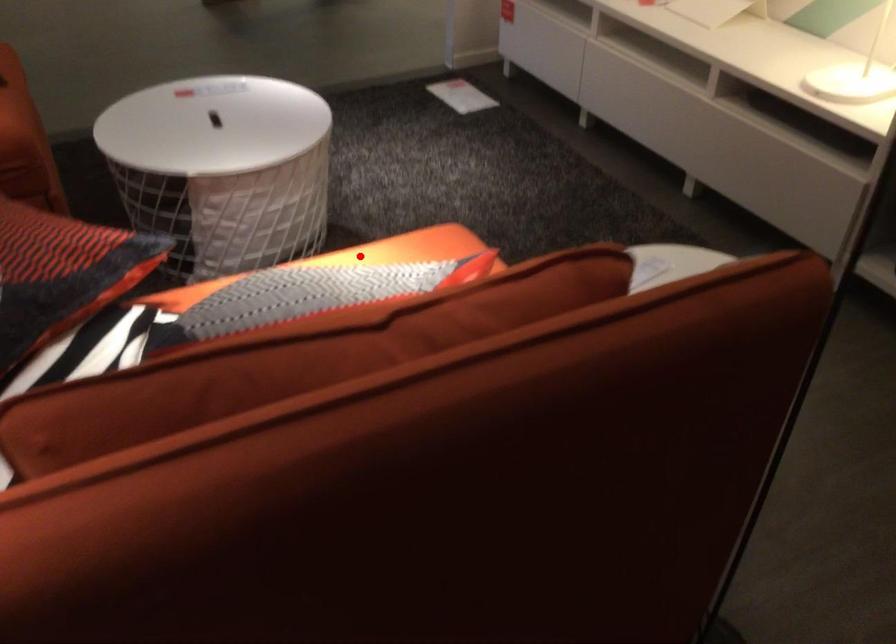
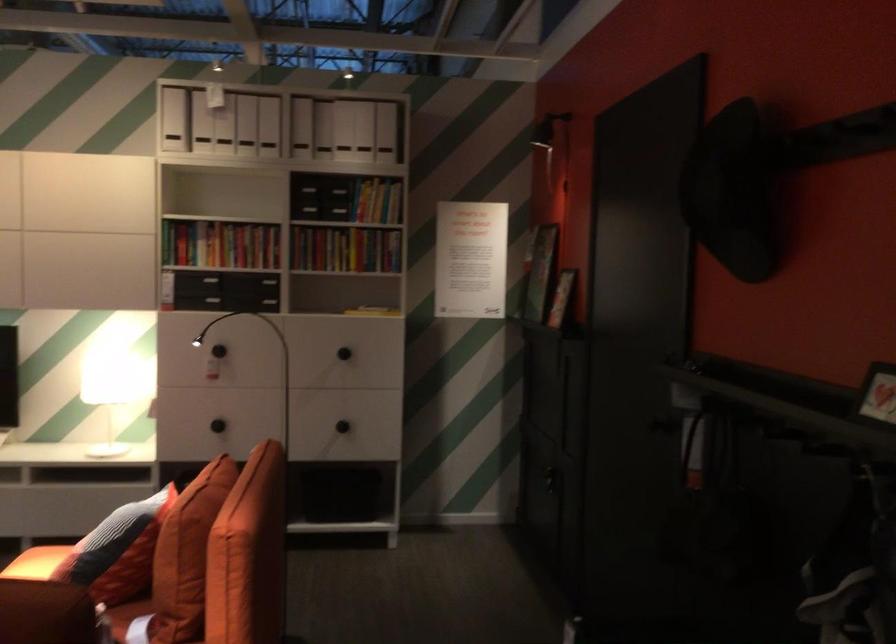
In the second image, find the point that corresponds to the highlighted location in the first image.

(36, 563)